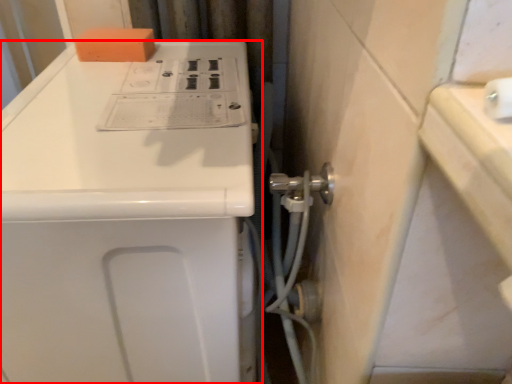
Question: From the image's perspective, where is home appliance (annotated by the red box) located relative to soap?

Choices:
 (A) above
 (B) below

Answer: (B)